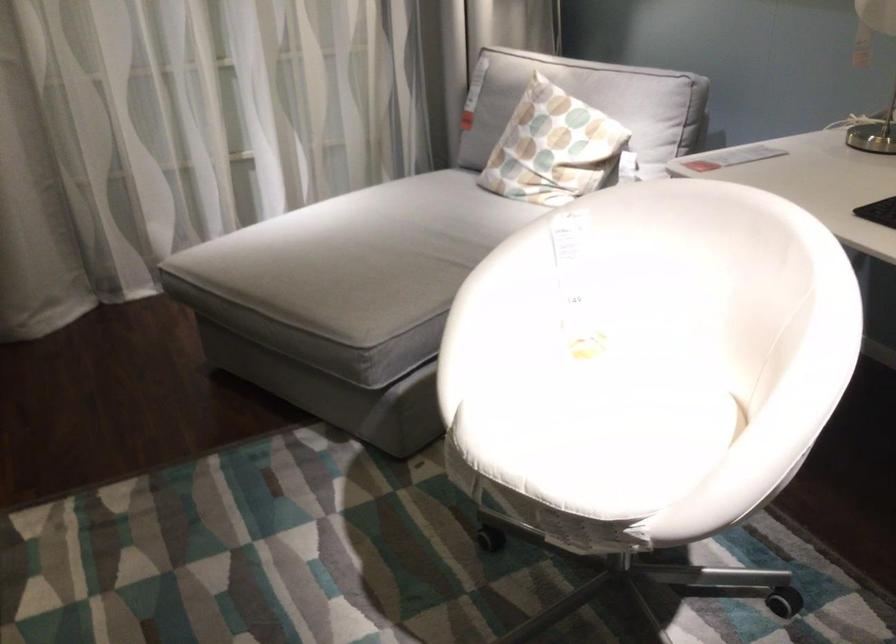
The image size is (896, 644). Find the location of `white chair sitting surface`. white chair sitting surface is located at coordinates (598, 431).